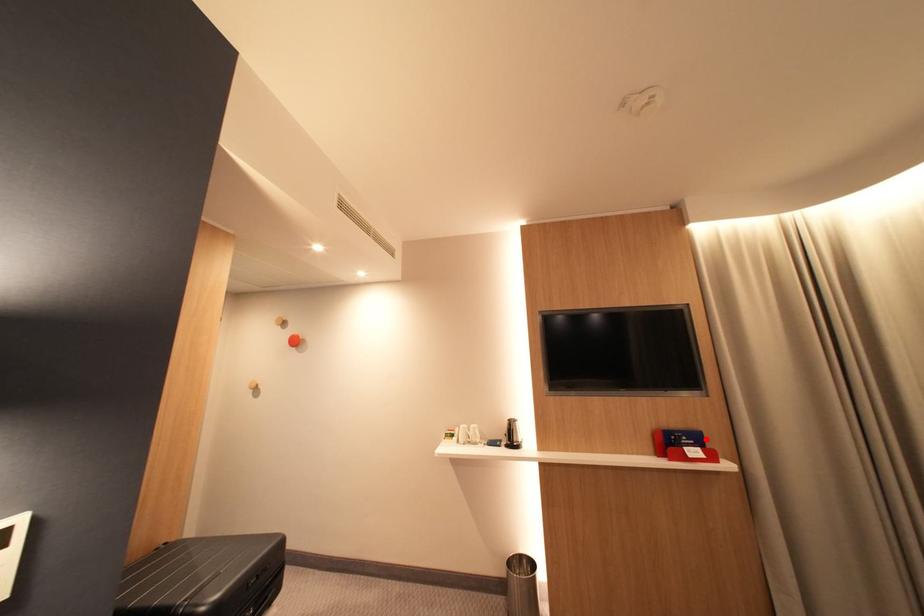
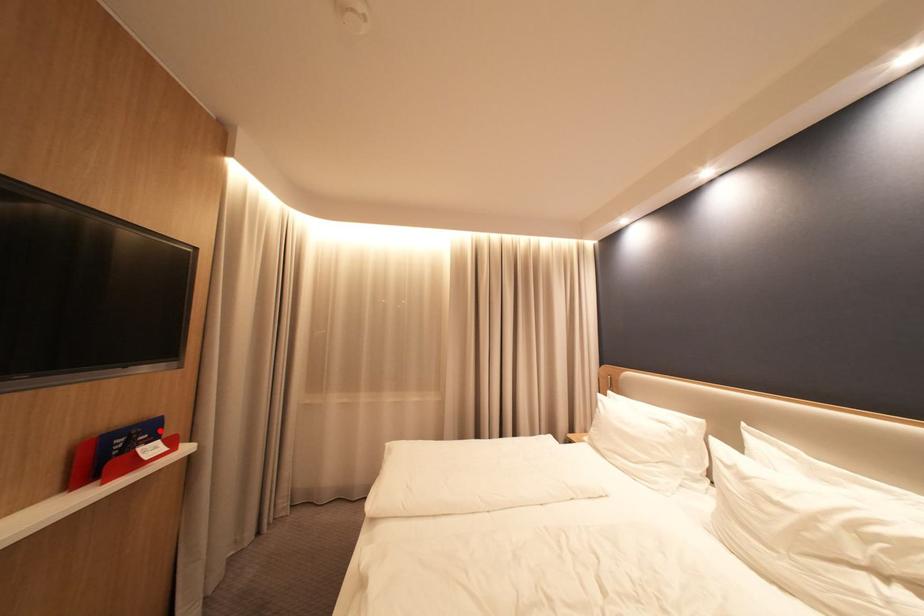
I am providing you with two images of the same scene from different viewpoints. A red point is marked on the first image and another point is marked on the second image. Is the marked point in image1 the same physical position as the marked point in image2?

Yes